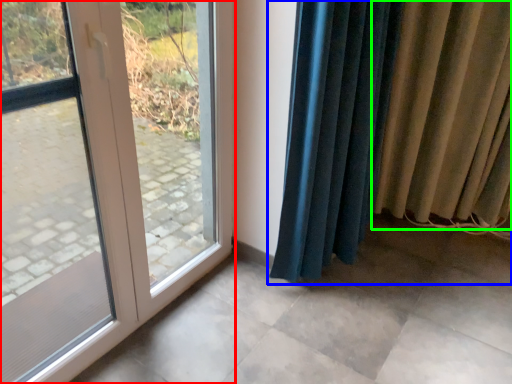
Question: Which object is the closest to the door (highlighted by a red box)? Choose among these: curtain (highlighted by a blue box) or curtain (highlighted by a green box).

Choices:
 (A) curtain
 (B) curtain

Answer: (B)